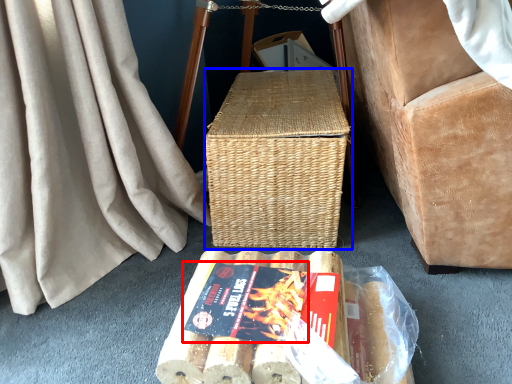
Question: Which of the following is the farthest to the observer, paperback book (highlighted by a red box) or picnic basket (highlighted by a blue box)?

Choices:
 (A) paperback book
 (B) picnic basket

Answer: (B)